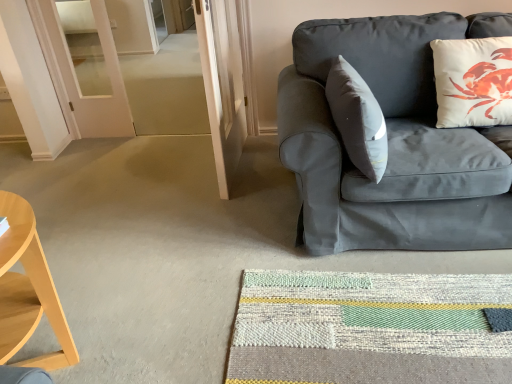
Question: Is light wood/wooden desk at left aimed at textured woven mat at lower center?

Choices:
 (A) yes
 (B) no

Answer: (A)

Question: Is light wood/wooden desk at left wider than textured woven mat at lower center?

Choices:
 (A) yes
 (B) no

Answer: (B)

Question: Is light wood/wooden desk at left at the right side of textured woven mat at lower center?

Choices:
 (A) no
 (B) yes

Answer: (A)

Question: From a real-world perspective, is light wood/wooden desk at left physically below textured woven mat at lower center?

Choices:
 (A) yes
 (B) no

Answer: (B)

Question: Is textured woven mat at lower center at the back of light wood/wooden desk at left?

Choices:
 (A) no
 (B) yes

Answer: (A)

Question: Is textured woven mat at lower center spatially inside white matte pillow at upper right, or outside of it?

Choices:
 (A) inside
 (B) outside

Answer: (B)

Question: From a real-world perspective, relative to white matte pillow at upper right, is textured woven mat at lower center vertically above or below?

Choices:
 (A) above
 (B) below

Answer: (B)

Question: Considering the positions of textured woven mat at lower center and white matte pillow at upper right in the image, is textured woven mat at lower center bigger or smaller than white matte pillow at upper right?

Choices:
 (A) big
 (B) small

Answer: (B)

Question: Does point pyautogui.click(x=457, y=311) appear closer or farther from the camera than point pyautogui.click(x=454, y=112)?

Choices:
 (A) closer
 (B) farther

Answer: (A)

Question: From a real-world perspective, is white matte pillow at upper right positioned above or below matte gray couch at right?

Choices:
 (A) below
 (B) above

Answer: (B)

Question: In terms of width, does white matte pillow at upper right look wider or thinner when compared to matte gray couch at right?

Choices:
 (A) thin
 (B) wide

Answer: (A)

Question: Is white matte pillow at upper right to the left or to the right of matte gray couch at right in the image?

Choices:
 (A) left
 (B) right

Answer: (B)

Question: Do you think white matte pillow at upper right is within matte gray couch at right, or outside of it?

Choices:
 (A) outside
 (B) inside

Answer: (B)

Question: In terms of height, does matte gray couch at right look taller or shorter compared to light wood/wooden desk at left?

Choices:
 (A) tall
 (B) short

Answer: (A)

Question: Is matte gray couch at right inside the boundaries of light wood/wooden desk at left, or outside?

Choices:
 (A) inside
 (B) outside

Answer: (B)